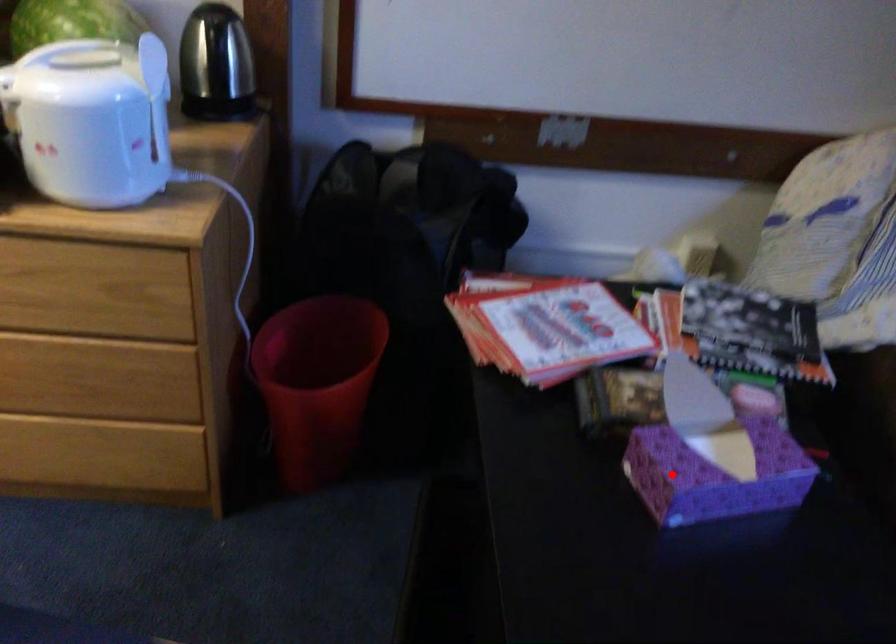
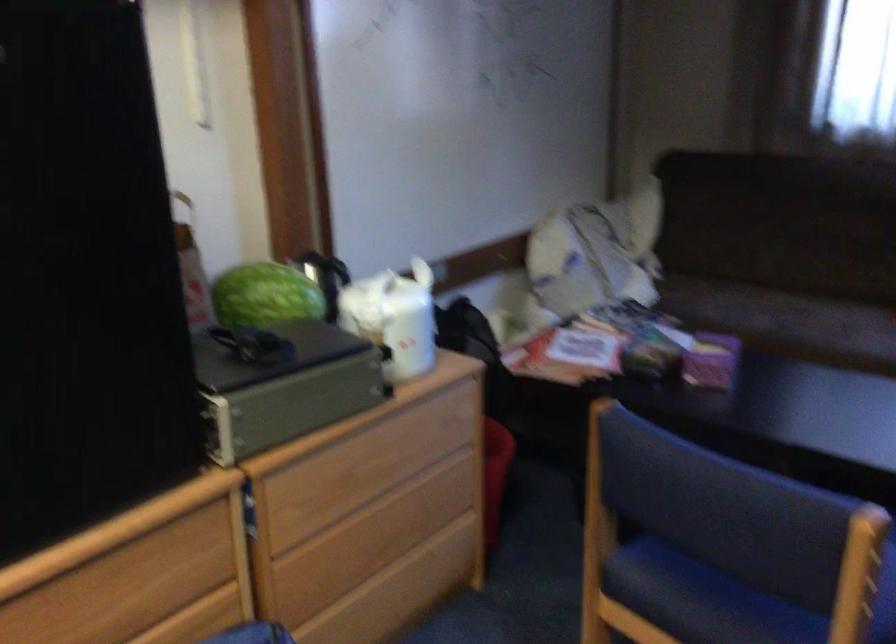
Question: I am providing you with two images of the same scene from different viewpoints. Image1 has a red point marked. In image2, the corresponding 3D location appears at what relative position? Reply with the corresponding letter.

Choices:
 (A) Closer
 (B) Farther

Answer: (B)